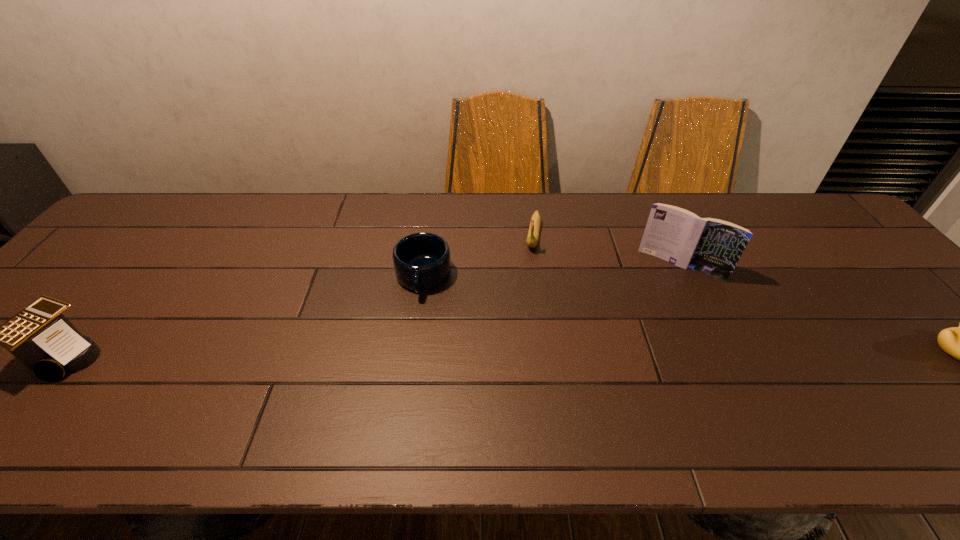
This screenshot has height=540, width=960. Find the location of `vacant space located 0.270m at the stem of the third object from left to right`. vacant space located 0.270m at the stem of the third object from left to right is located at coordinates (522, 327).

Locate an element on the screen. The width and height of the screenshot is (960, 540). vacant region located 0.120m at the stem of the third object from left to right is located at coordinates (529, 284).

Locate an element on the screen. Image resolution: width=960 pixels, height=540 pixels. blank area located with the handle on the side of the fourth object from right to left is located at coordinates [411, 343].

At what (x,y) coordinates should I click in order to perform the action: click on free space located with the handle on the side of the fourth object from right to left. Please return your answer as a coordinate pair (x, y). The width and height of the screenshot is (960, 540). Looking at the image, I should click on (412, 336).

Locate an element on the screen. vacant space situated with the handle on the side of the fourth object from right to left is located at coordinates (407, 361).

I want to click on object at the far edge, so click(x=533, y=234).

At what (x,y) coordinates should I click in order to perform the action: click on object present at the near edge. Please return your answer as a coordinate pair (x, y). This screenshot has height=540, width=960. Looking at the image, I should click on (40, 336).

I want to click on object that is at the left edge, so click(x=40, y=336).

Locate an element on the screen. Image resolution: width=960 pixels, height=540 pixels. object positioned at the near left corner is located at coordinates (40, 336).

Locate an element on the screen. Image resolution: width=960 pixels, height=540 pixels. free space at the far edge is located at coordinates (465, 197).